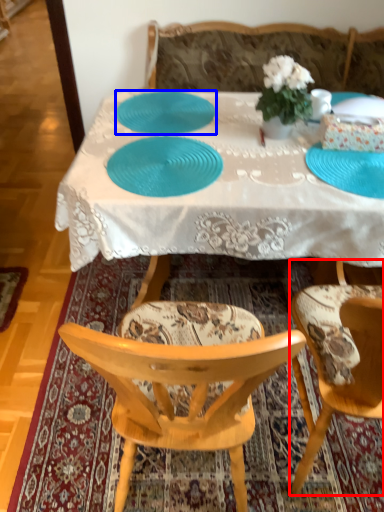
Question: Which object is closer to the camera taking this photo, chair (highlighted by a red box) or plate (highlighted by a blue box)?

Choices:
 (A) chair
 (B) plate

Answer: (A)